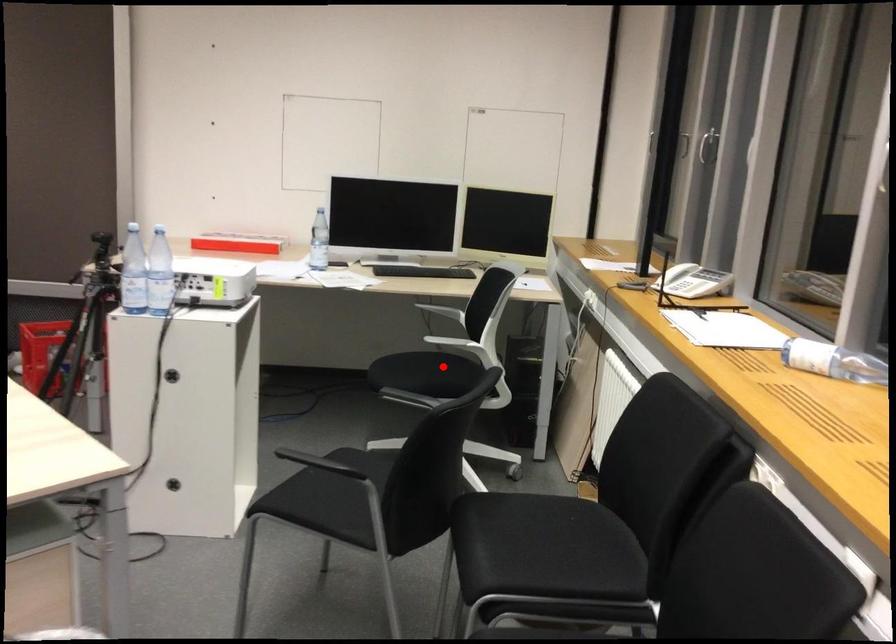
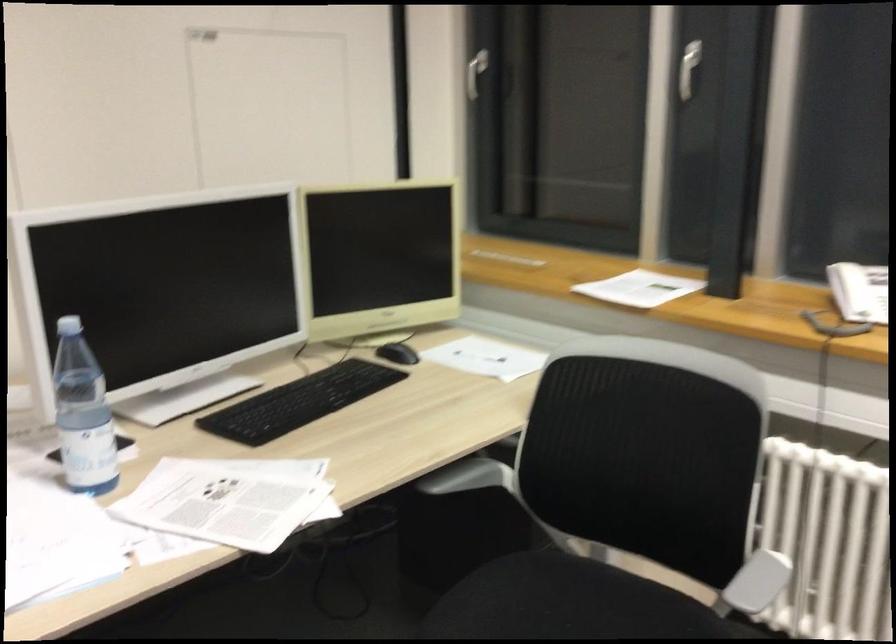
Question: I am providing you with two images of the same scene from different viewpoints. In image1, a red point is highlighted. Considering the same 3D point in image2, which of the following is correct?

Choices:
 (A) It is closer
 (B) It is farther

Answer: (A)